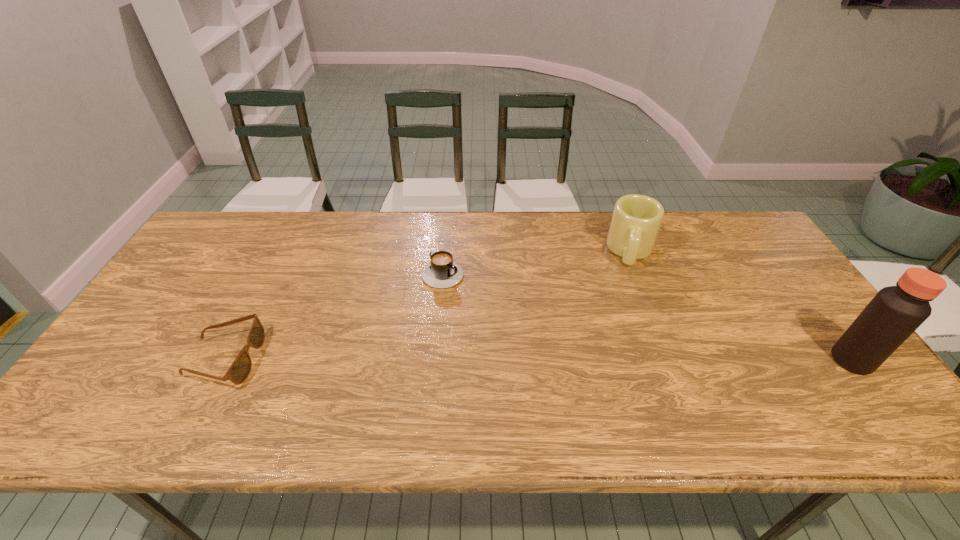
You are a GUI agent. You are given a task and a screenshot of the screen. Output one action in this format:
    pyautogui.click(x=<x>, y=<y>)
    Task: Click on the vacant spot on the desktop that is between the sunglasses and the rightmost object and is positioned with the handle on the side of the mug
    This screenshot has width=960, height=540.
    Given the screenshot: What is the action you would take?
    pyautogui.click(x=620, y=360)

The width and height of the screenshot is (960, 540). Identify the location of free space on the desktop that is between the sunglasses and the rightmost object and is positioned with the handle on the side of the third object from right to left. (597, 360).